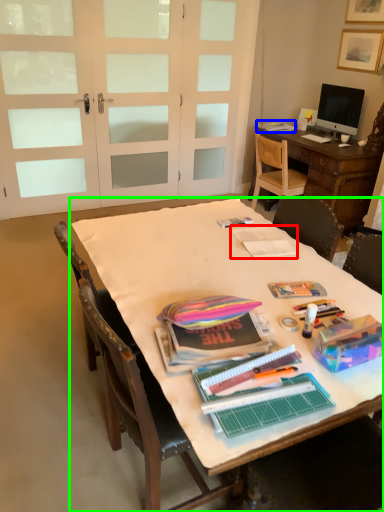
Question: Estimate the real-world distances between objects in this image. Which object is closer to magazine (highlighted by a red box), magazine (highlighted by a blue box) or table (highlighted by a green box)?

Choices:
 (A) magazine
 (B) table

Answer: (B)